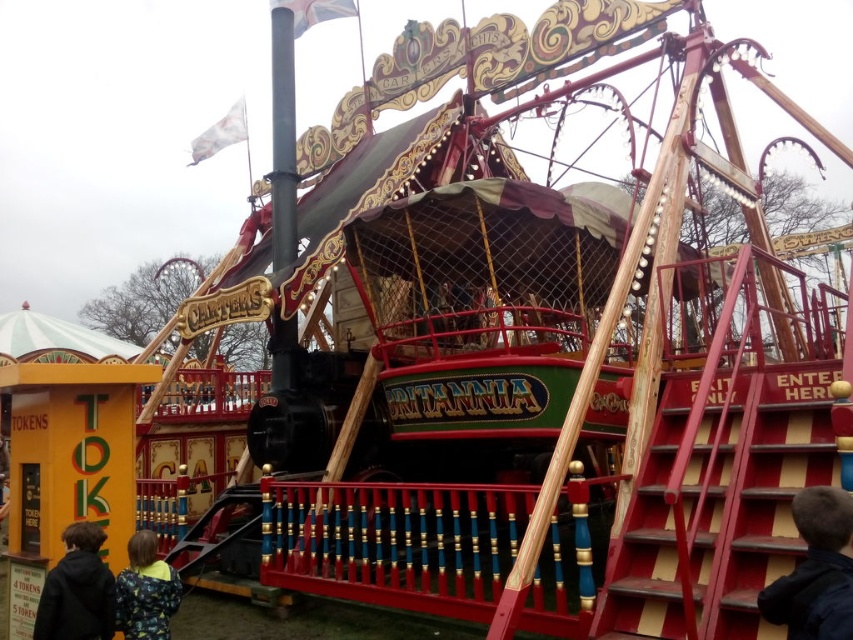
Between dark blue jacket at lower left and camouflage jacket at lower left, which one appears on the left side from the viewer's perspective?

dark blue jacket at lower left is more to the left.

Does dark blue jacket at lower left have a greater width compared to camouflage jacket at lower left?

Yes.

What do you see at coordinates (77, 589) in the screenshot? The width and height of the screenshot is (853, 640). I see `dark blue jacket at lower left` at bounding box center [77, 589].

The image size is (853, 640). Identify the location of dark blue jacket at lower left. (77, 589).

Does dark blue jacket at lower right appear under camouflage jacket at lower left?

Actually, dark blue jacket at lower right is above camouflage jacket at lower left.

Is dark blue jacket at lower right to the left of camouflage jacket at lower left from the viewer's perspective?

In fact, dark blue jacket at lower right is to the right of camouflage jacket at lower left.

Between point (817, 611) and point (167, 566), which one is positioned in front?

Point (817, 611)

What are the coordinates of `dark blue jacket at lower right` in the screenshot? It's located at (816, 570).

Does dark blue jacket at lower right appear over dark blue jacket at lower left?

Indeed, dark blue jacket at lower right is positioned over dark blue jacket at lower left.

Between dark blue jacket at lower right and dark blue jacket at lower left, which one is positioned higher?

Positioned higher is dark blue jacket at lower right.

Which is in front, point (810, 552) or point (88, 563)?

Point (810, 552)

The height and width of the screenshot is (640, 853). Identify the location of dark blue jacket at lower right. (816, 570).